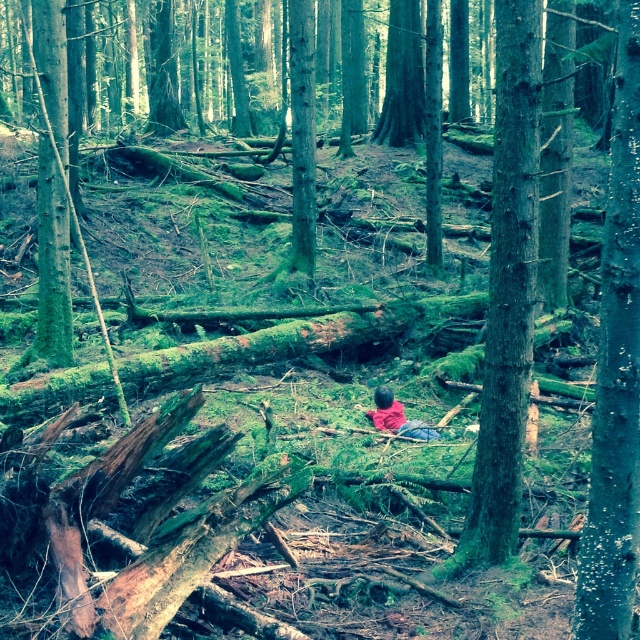
Question: Is green mossy log at center bigger than red fabric child at center?

Choices:
 (A) no
 (B) yes

Answer: (A)

Question: Does green mossy tree at left appear under red fabric child at center?

Choices:
 (A) yes
 (B) no

Answer: (B)

Question: Which point appears farthest from the camera in this image?

Choices:
 (A) (604, 236)
 (B) (64, 154)
 (C) (397, 410)

Answer: (B)

Question: Estimate the real-world distances between objects in this image. Which object is closer to the green mossy tree at left?

Choices:
 (A) green rough bark tree at center
 (B) green mossy log at center

Answer: (A)

Question: Which is farther from the red fabric child at center?

Choices:
 (A) green mossy log at center
 (B) green rough bark tree at center

Answer: (A)

Question: Is green rough bark tree at center positioned before red fabric child at center?

Choices:
 (A) yes
 (B) no

Answer: (A)